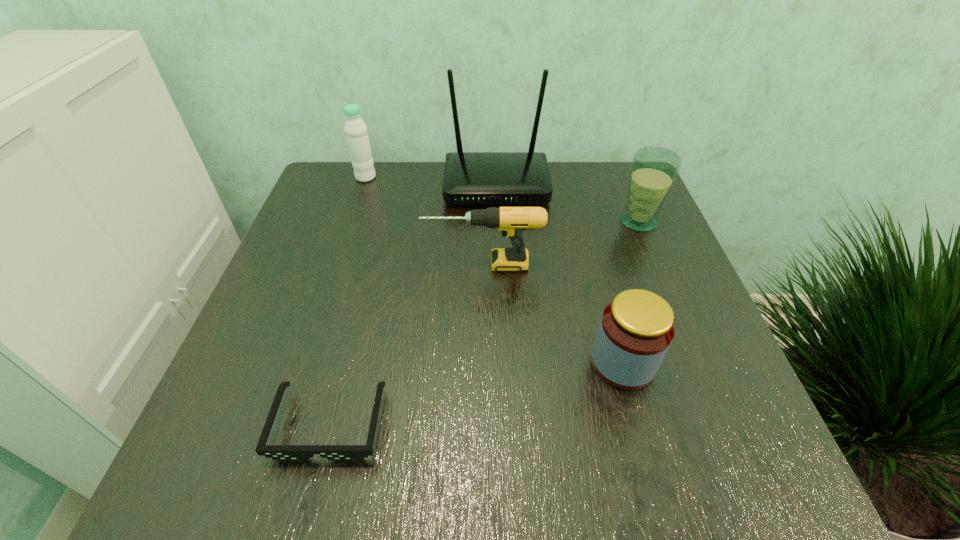
Where is `vacant area that satisfies the following two spatial constraints: 1. on the handle side of the third nearest object; 2. on the front-facing side of the sunglasses`? vacant area that satisfies the following two spatial constraints: 1. on the handle side of the third nearest object; 2. on the front-facing side of the sunglasses is located at coordinates (484, 424).